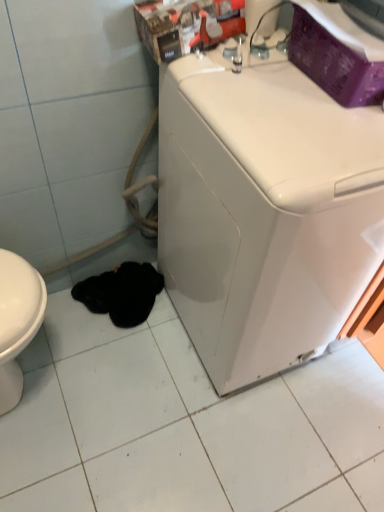
Question: Does black soft cloth at lower left have a larger size compared to white glossy washing machine at center?

Choices:
 (A) no
 (B) yes

Answer: (A)

Question: Could you tell me if black soft cloth at lower left is facing white glossy washing machine at center?

Choices:
 (A) yes
 (B) no

Answer: (B)

Question: Is black soft cloth at lower left further to camera compared to white glossy washing machine at center?

Choices:
 (A) no
 (B) yes

Answer: (B)

Question: Does black soft cloth at lower left have a greater height compared to white glossy washing machine at center?

Choices:
 (A) no
 (B) yes

Answer: (A)

Question: Considering the relative sizes of black soft cloth at lower left and white glossy washing machine at center in the image provided, is black soft cloth at lower left thinner than white glossy washing machine at center?

Choices:
 (A) yes
 (B) no

Answer: (A)

Question: Does black soft cloth at lower left appear on the left side of white glossy washing machine at center?

Choices:
 (A) no
 (B) yes

Answer: (B)

Question: Does white glossy washing machine at center come in front of black soft cloth at lower left?

Choices:
 (A) yes
 (B) no

Answer: (A)

Question: Is white glossy washing machine at center facing away from black soft cloth at lower left?

Choices:
 (A) yes
 (B) no

Answer: (B)

Question: Is the depth of white glossy washing machine at center greater than that of black soft cloth at lower left?

Choices:
 (A) no
 (B) yes

Answer: (A)

Question: Is white glossy washing machine at center surrounding black soft cloth at lower left?

Choices:
 (A) yes
 (B) no

Answer: (B)

Question: Is white glossy washing machine at center bigger than black soft cloth at lower left?

Choices:
 (A) no
 (B) yes

Answer: (B)

Question: From a real-world perspective, is white glossy washing machine at center located beneath black soft cloth at lower left?

Choices:
 (A) yes
 (B) no

Answer: (B)

Question: Is black soft cloth at lower left spatially inside white glossy washing machine at center, or outside of it?

Choices:
 (A) inside
 (B) outside

Answer: (B)